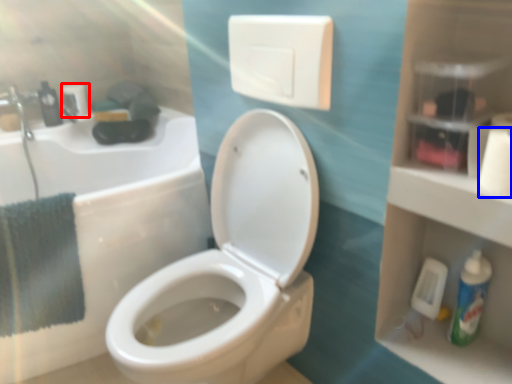
Question: Which point is closer to the camera, toilet paper (highlighted by a red box) or toilet paper (highlighted by a blue box)?

Choices:
 (A) toilet paper
 (B) toilet paper

Answer: (B)